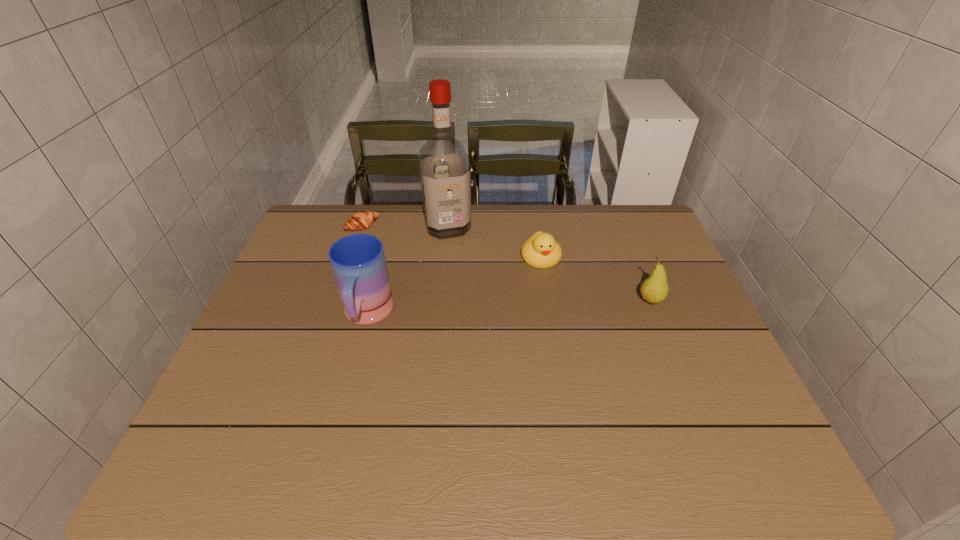
Locate an element on the screen. This screenshot has width=960, height=540. vacant spot on the desktop that is between the mug and the rightmost object and is positioned on the front-facing side of the tallest object is located at coordinates (474, 310).

Locate an element on the screen. The width and height of the screenshot is (960, 540). vacant spot on the desktop that is between the second tallest object and the third shortest object and is positioned on the front-facing side of the shortest object is located at coordinates (468, 310).

Locate an element on the screen. This screenshot has height=540, width=960. vacant space on the desktop that is between the mug and the rightmost object and is positioned on the face of the duckling is located at coordinates (553, 306).